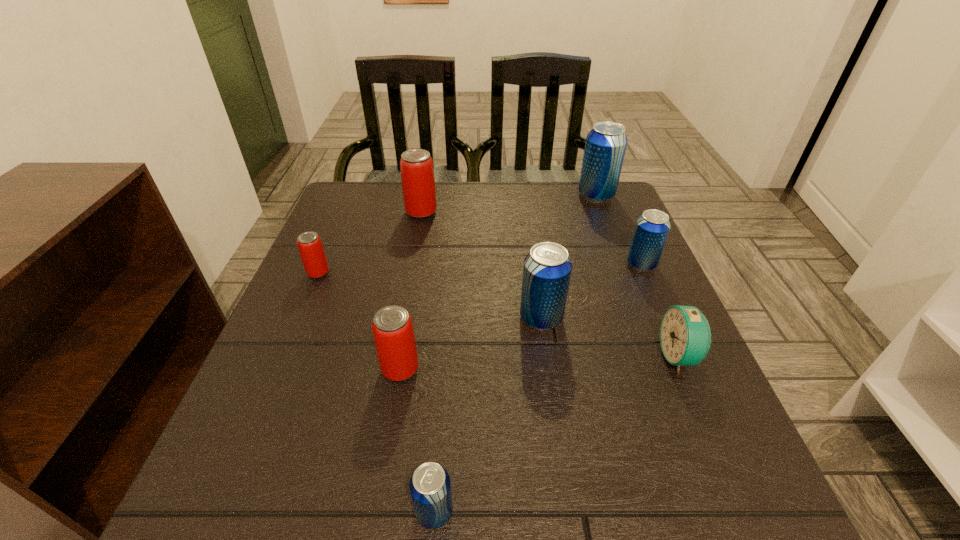
The height and width of the screenshot is (540, 960). What are the coordinates of `the tallest object` in the screenshot? It's located at (606, 143).

Locate an element on the screen. the biggest blue beer can is located at coordinates (606, 143).

At what (x,y) coordinates should I click in order to perform the action: click on the farthest pink beer can. Please return your answer as a coordinate pair (x, y). The width and height of the screenshot is (960, 540). Looking at the image, I should click on (416, 165).

The height and width of the screenshot is (540, 960). What are the coordinates of `the fourth object from right to left` in the screenshot? It's located at 547,269.

The width and height of the screenshot is (960, 540). Identify the location of the second nearest blue beer can. (547, 269).

Locate an element on the screen. The width and height of the screenshot is (960, 540). the third nearest blue beer can is located at coordinates coord(651,230).

Locate an element on the screen. The image size is (960, 540). the nearest pink beer can is located at coordinates (392, 327).

Where is `the second smallest pink beer can`? The height and width of the screenshot is (540, 960). the second smallest pink beer can is located at coordinates (392, 327).

Locate an element on the screen. blue alarm clock is located at coordinates (685, 337).

You are a GUI agent. You are given a task and a screenshot of the screen. Output one action in this format:
    pyautogui.click(x=<x>, y=<y>)
    Task: Click on the leftmost pink beer can
    
    Given the screenshot: What is the action you would take?
    pyautogui.click(x=311, y=250)